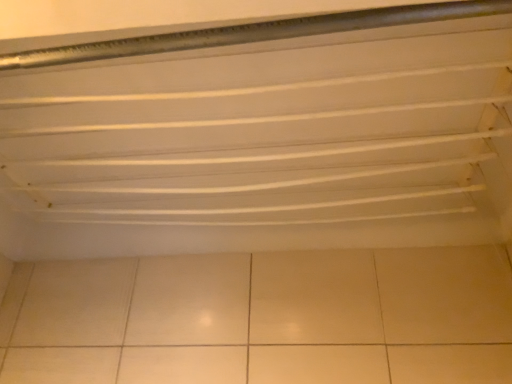
Question: From the image's perspective, is beige ceramic tile at bottom above or below white matte shelf at upper center?

Choices:
 (A) above
 (B) below

Answer: (B)

Question: Looking at the image, does beige ceramic tile at bottom seem bigger or smaller compared to white matte shelf at upper center?

Choices:
 (A) small
 (B) big

Answer: (A)

Question: From their relative heights in the image, would you say beige ceramic tile at bottom is taller or shorter than white matte shelf at upper center?

Choices:
 (A) short
 (B) tall

Answer: (B)

Question: Is white matte shelf at upper center in front of or behind beige ceramic tile at bottom in the image?

Choices:
 (A) front
 (B) behind

Answer: (A)

Question: Considering the positions of white matte shelf at upper center and beige ceramic tile at bottom in the image, is white matte shelf at upper center taller or shorter than beige ceramic tile at bottom?

Choices:
 (A) tall
 (B) short

Answer: (B)

Question: Looking at their shapes, would you say white matte shelf at upper center is wider or thinner than beige ceramic tile at bottom?

Choices:
 (A) wide
 (B) thin

Answer: (A)

Question: From a real-world perspective, is white matte shelf at upper center above or below beige ceramic tile at bottom?

Choices:
 (A) below
 (B) above

Answer: (B)